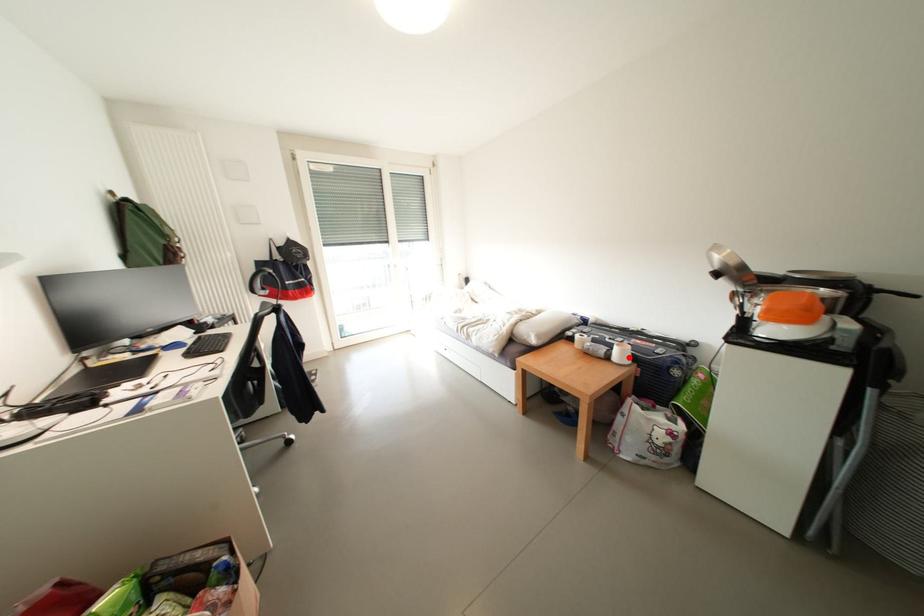
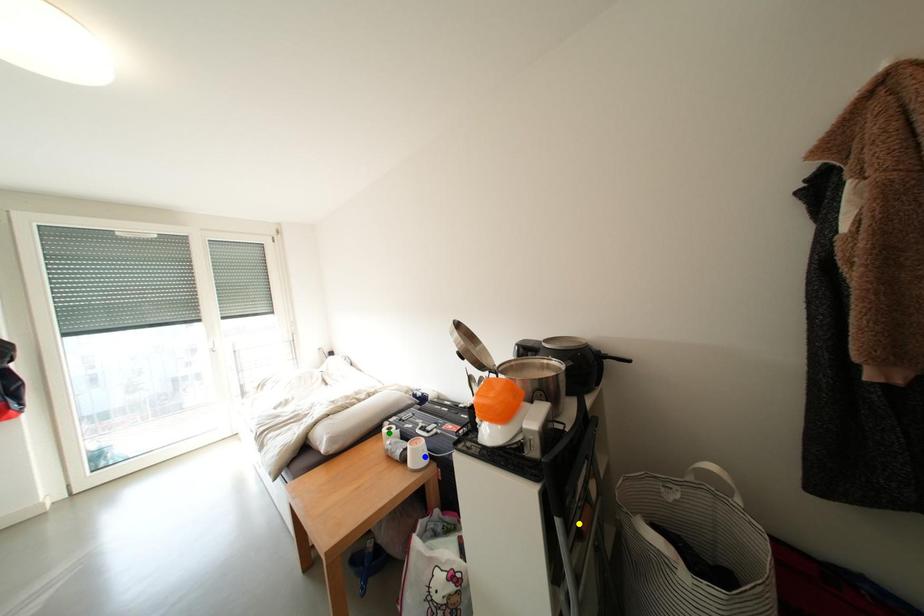
Question: I am providing you with two images of the same scene from different viewpoints. A red point is marked on the first image. You are given multiple points on the second image. Which point in image 2 is actually the same real-world point as the red point in image 1?

Choices:
 (A) green point
 (B) blue point
 (C) yellow point

Answer: (B)